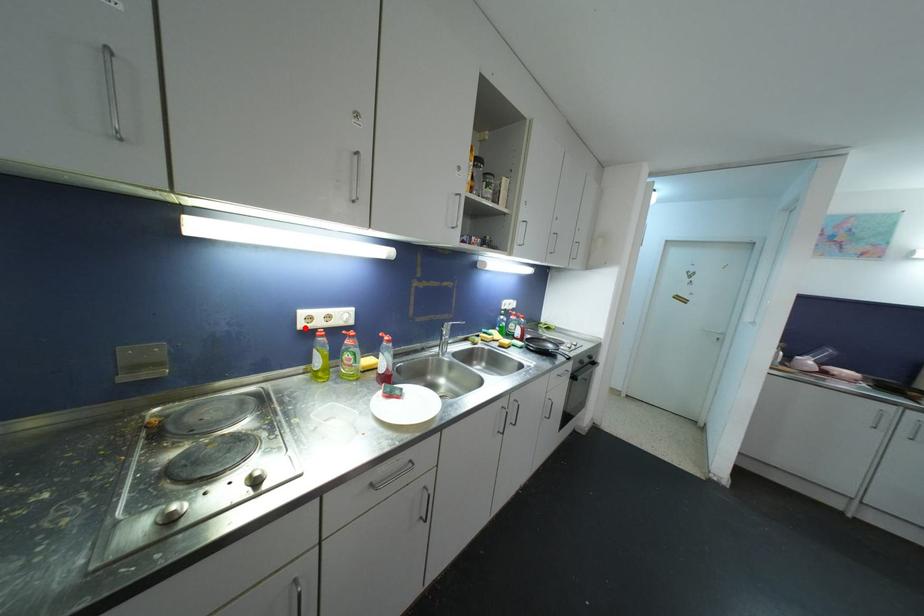
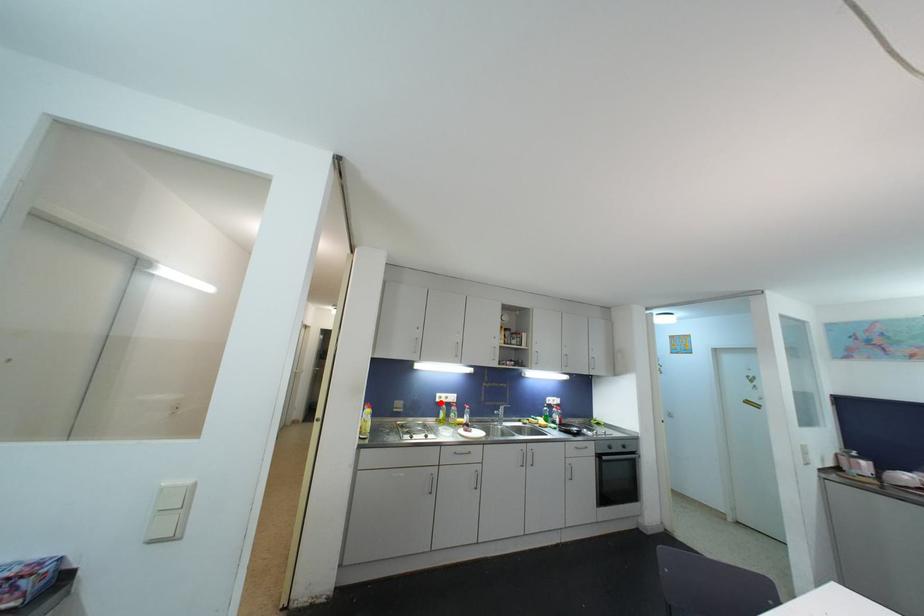
I am providing you with two images of the same scene from different viewpoints. A red point is marked on the first image and another point is marked on the second image. Do the highlighted points in image1 and image2 indicate the same real-world spot?

Yes